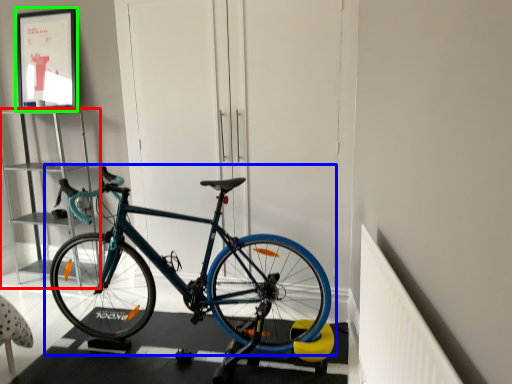
Question: Estimate the real-world distances between objects in this image. Which object is closer to cabinet (highlighted by a red box), bicycle (highlighted by a blue box) or picture frame (highlighted by a green box)?

Choices:
 (A) bicycle
 (B) picture frame

Answer: (B)